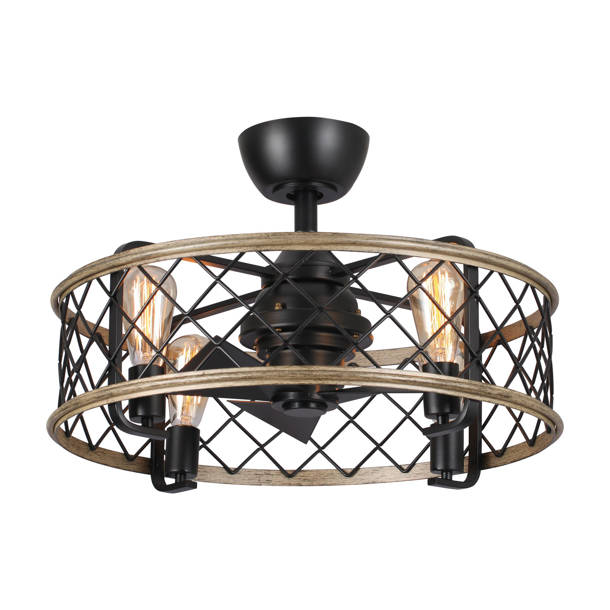
I want to click on top of fan, so click(x=310, y=138).